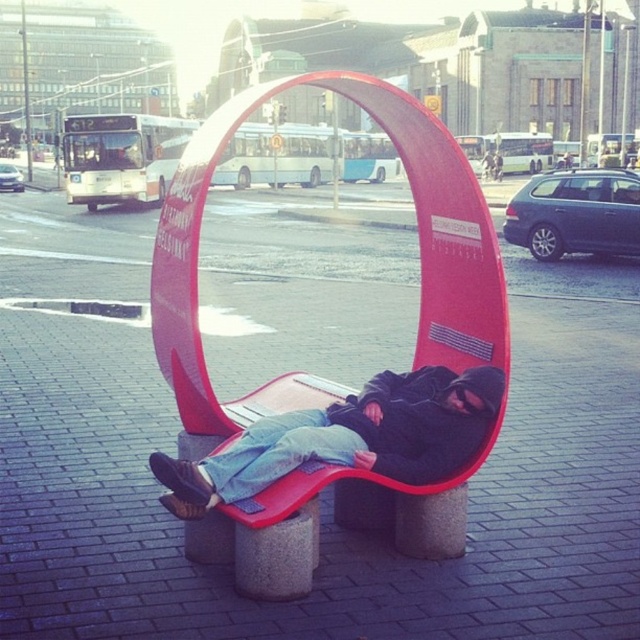
Does point (252, 561) lie behind point (381, 472)?

No.

From the picture: Is matte plastic bench at center below denim jacket at center?

Incorrect, matte plastic bench at center is not positioned below denim jacket at center.

Where is `matte plastic bench at center`? Image resolution: width=640 pixels, height=640 pixels. matte plastic bench at center is located at coordinates (419, 260).